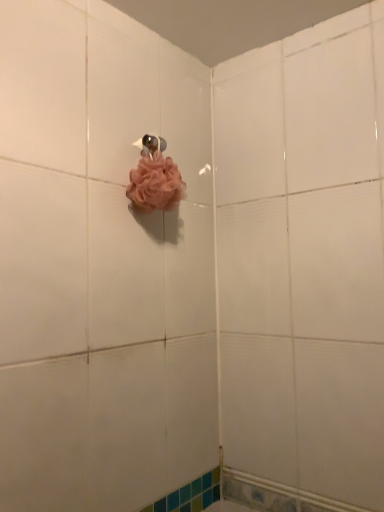
In order to face pink sponge at upper center, should I rotate leftwards or rightwards?

You should rotate left by 5.655 degrees.

This screenshot has width=384, height=512. Describe the element at coordinates (150, 145) in the screenshot. I see `pink sponge at upper center` at that location.

Where is `pink sponge at upper center`? The height and width of the screenshot is (512, 384). pink sponge at upper center is located at coordinates (150, 145).

Image resolution: width=384 pixels, height=512 pixels. Identify the location of pink sponge at upper center. (150, 145).